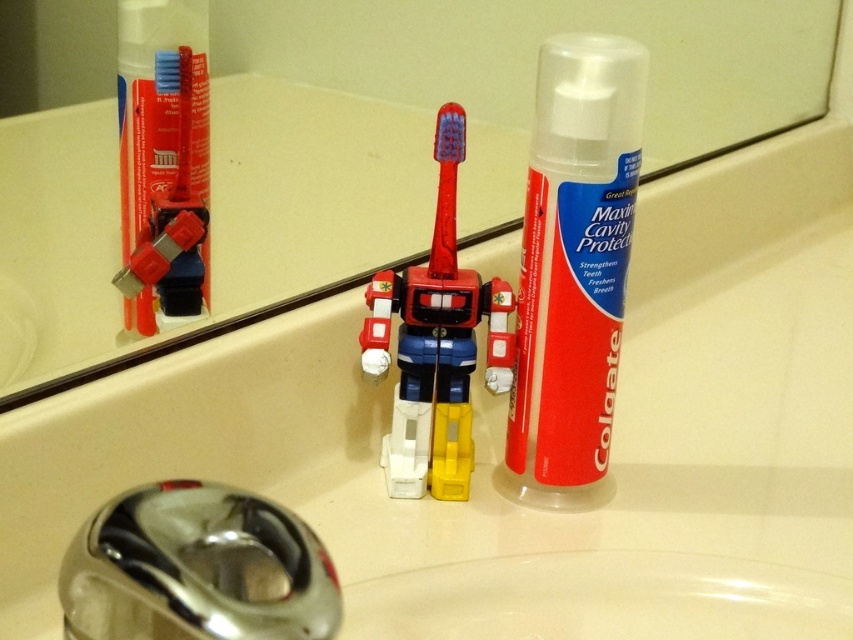
You are trying to reach for the matte plastic toothbrush at upper center but there is a chrome metallic faucet at lower left in the way. Can you move your hand around the faucet to grab the toothbrush?

The chrome metallic faucet at lower left is closer to the viewer than the matte plastic toothbrush at upper center, so you can move your hand around the faucet to reach the toothbrush.

Based on the photo, you are standing in front of the bathroom sink and want to place a small object on the edge. There are two points marked on the sink edge at coordinates point (622, 228) and point (123, 278). If you want to place the object where it will be more visible to someone approaching from the front, which point should you choose?

You should choose point (622, 228) because it is closer to the viewer, making it more visible to someone approaching from the front.